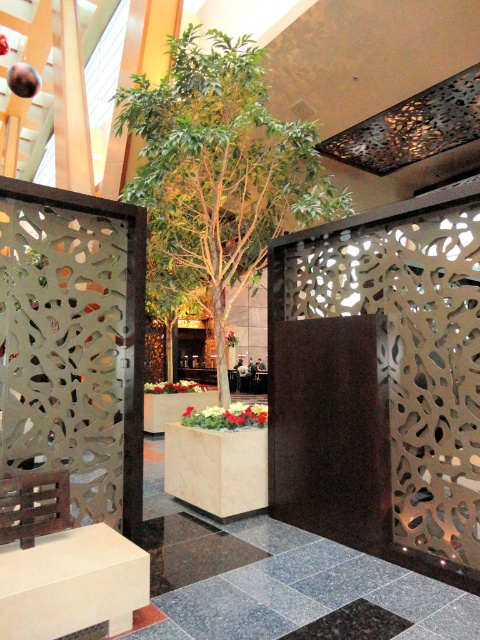
Between green leafy plant at center and green matte planter at center, which one is positioned lower?

green matte planter at center is lower down.

Locate an element on the screen. This screenshot has height=640, width=480. green leafy plant at center is located at coordinates (219, 170).

Image resolution: width=480 pixels, height=640 pixels. I want to click on green leafy plant at center, so click(219, 170).

What do you see at coordinates (219, 170) in the screenshot? This screenshot has width=480, height=640. I see `green leafy plant at center` at bounding box center [219, 170].

Does green leafy plant at center have a smaller size compared to floral arrangement at center?

Actually, green leafy plant at center might be larger than floral arrangement at center.

What are the coordinates of `green leafy plant at center` in the screenshot? It's located at (219, 170).

You are a GUI agent. You are given a task and a screenshot of the screen. Output one action in this format:
    pyautogui.click(x=<x>, y=<y>)
    Task: Click on the green leafy plant at center
    This screenshot has height=640, width=480.
    Given the screenshot: What is the action you would take?
    point(219,170)

Does floral arrangement at center appear under green matte planter at center?

No.

What are the coordinates of `floral arrangement at center` in the screenshot? It's located at (227, 417).

The image size is (480, 640). I want to click on floral arrangement at center, so click(227, 417).